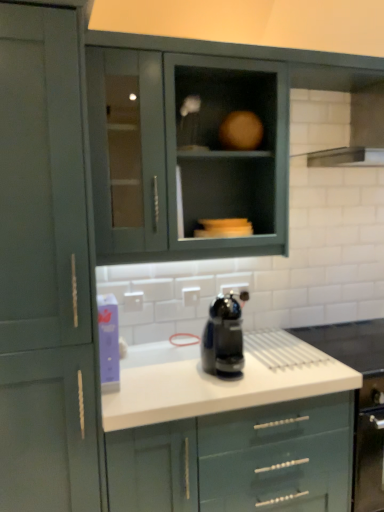
Where is `vacant area that is situated to the right of black glossy coffee maker at center`? vacant area that is situated to the right of black glossy coffee maker at center is located at coordinates (286, 373).